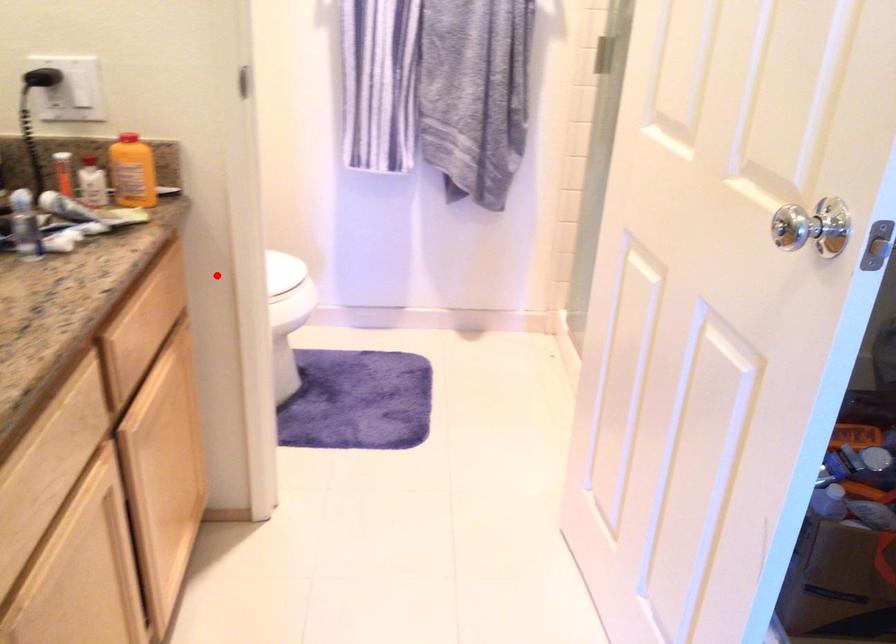
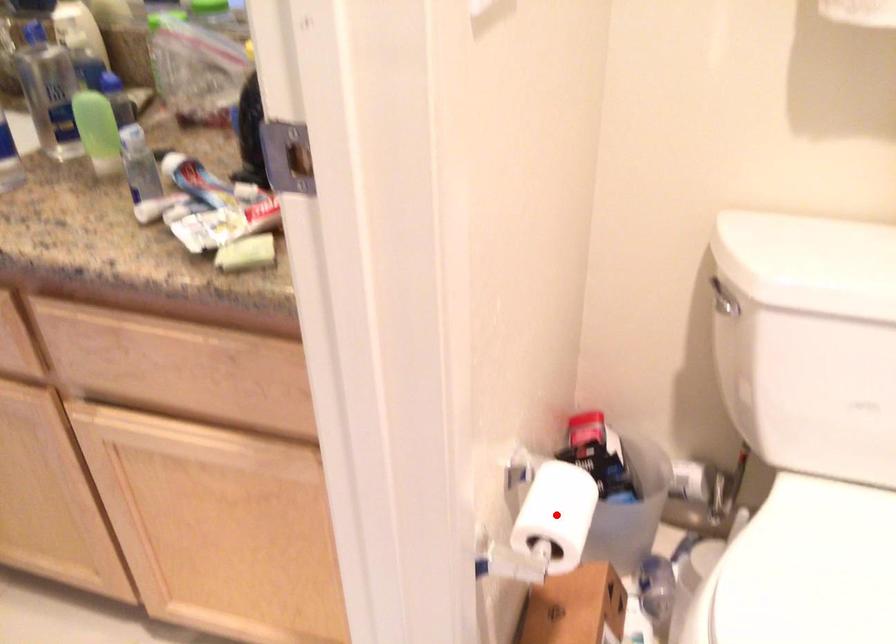
I am providing you with two images of the same scene from different viewpoints. A red point is marked on the first image and another point is marked on the second image. Are the points marked in image1 and image2 representing the same 3D position?

Yes